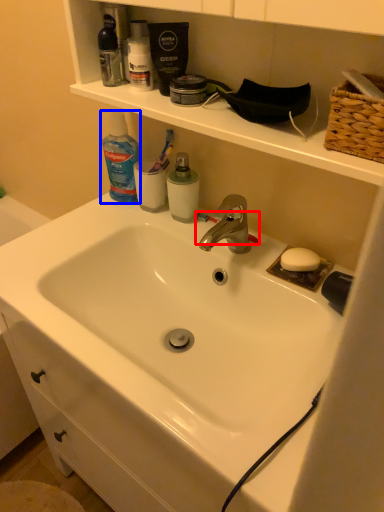
Question: Which object appears closest to the camera in this image, toothbrush (highlighted by a red box) or cleaning product (highlighted by a blue box)?

Choices:
 (A) toothbrush
 (B) cleaning product

Answer: (B)